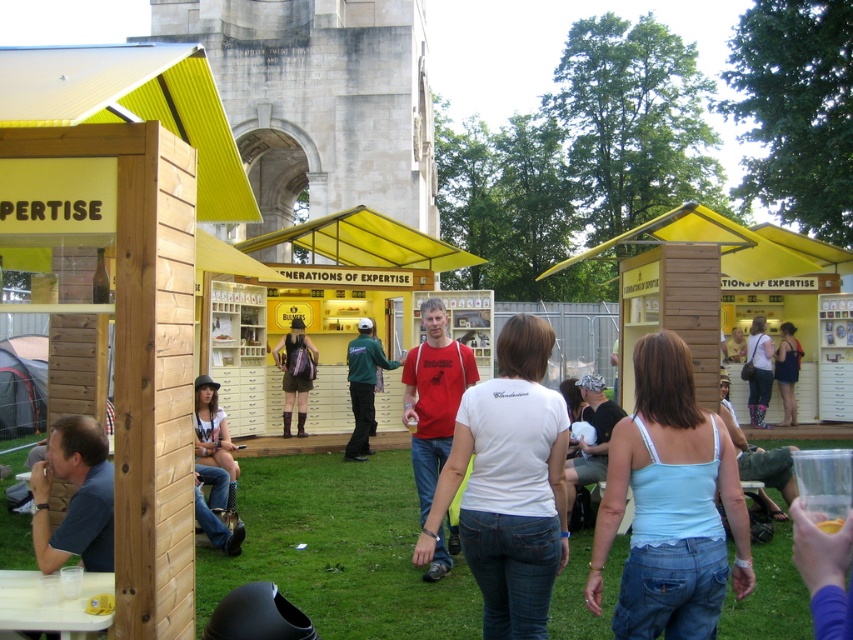
You are standing at the Generations of Expertise market and want to take a photo of both the point at coordinates (722,464) and the point at (795,371). Which point should you focus on first to ensure both are in clear view?

You should focus on point (722,464) first because it is closer to the camera than point (795,371). By focusing on the closer point, the farther point will still be in acceptable focus due to depth of field.

You are a fashion designer analyzing the denim shorts at lower left and denim shorts at center in the image. Which pair of denim shorts is shorter?

The denim shorts at lower left is shorter than the denim shorts at center.